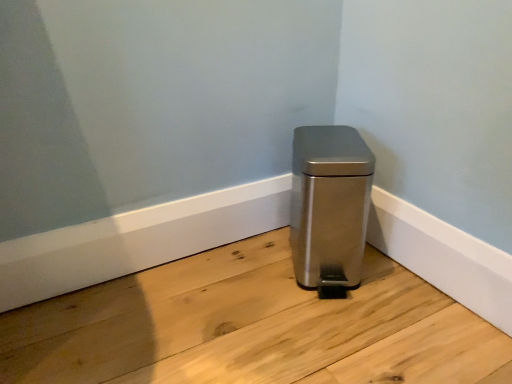
Where is `satin silver trash can at corner`? The height and width of the screenshot is (384, 512). satin silver trash can at corner is located at coordinates (329, 207).

What do you see at coordinates (329, 207) in the screenshot? I see `satin silver trash can at corner` at bounding box center [329, 207].

Locate an element on the screen. The width and height of the screenshot is (512, 384). satin silver trash can at corner is located at coordinates (329, 207).